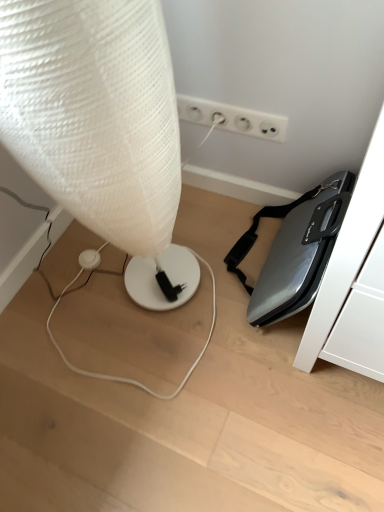
Question: From the image's perspective, relative to white plastic electrical outlet at upper center, is white textured lamp at left above or below?

Choices:
 (A) above
 (B) below

Answer: (B)

Question: Is white textured lamp at left spatially inside white plastic electrical outlet at upper center, or outside of it?

Choices:
 (A) inside
 (B) outside

Answer: (B)

Question: Relative to white plastic electrical outlet at upper center, is white textured lamp at left in front or behind?

Choices:
 (A) behind
 (B) front

Answer: (B)

Question: Based on their positions, is white plastic electrical outlet at upper center located to the left or right of white textured lamp at left?

Choices:
 (A) left
 (B) right

Answer: (B)

Question: From their relative heights in the image, would you say white plastic electrical outlet at upper center is taller or shorter than white textured lamp at left?

Choices:
 (A) short
 (B) tall

Answer: (A)

Question: From a real-world perspective, is white plastic electrical outlet at upper center positioned above or below white textured lamp at left?

Choices:
 (A) above
 (B) below

Answer: (B)

Question: From the image's perspective, is white plastic electrical outlet at upper center above or below white textured lamp at left?

Choices:
 (A) below
 (B) above

Answer: (B)